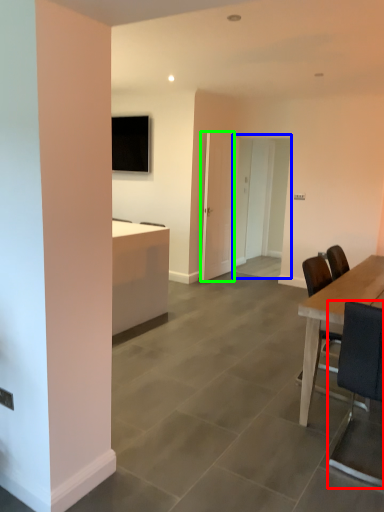
Question: Which object is the farthest from chair (highlighted by a red box)? Choose among these: glass door (highlighted by a blue box) or glass door (highlighted by a green box).

Choices:
 (A) glass door
 (B) glass door

Answer: (A)